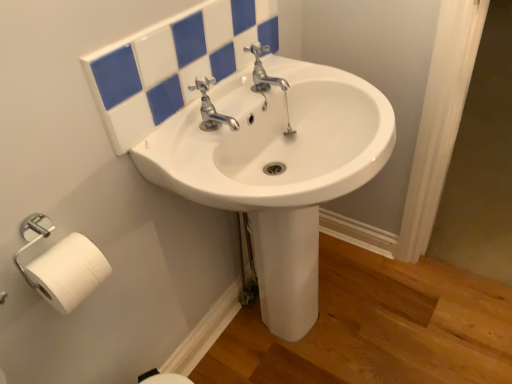
I want to click on free space behind chrome metallic faucet at center, so click(x=240, y=108).